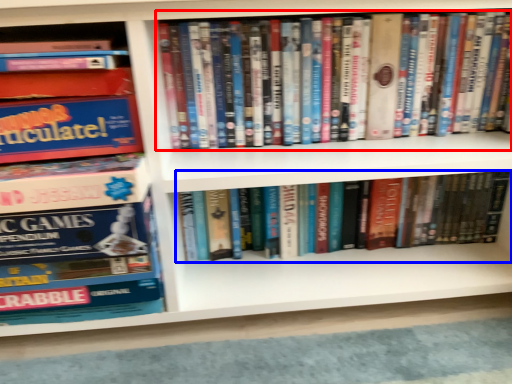
Question: Among these objects, which one is nearest to the camera, book (highlighted by a red box) or book (highlighted by a blue box)?

Choices:
 (A) book
 (B) book

Answer: (A)